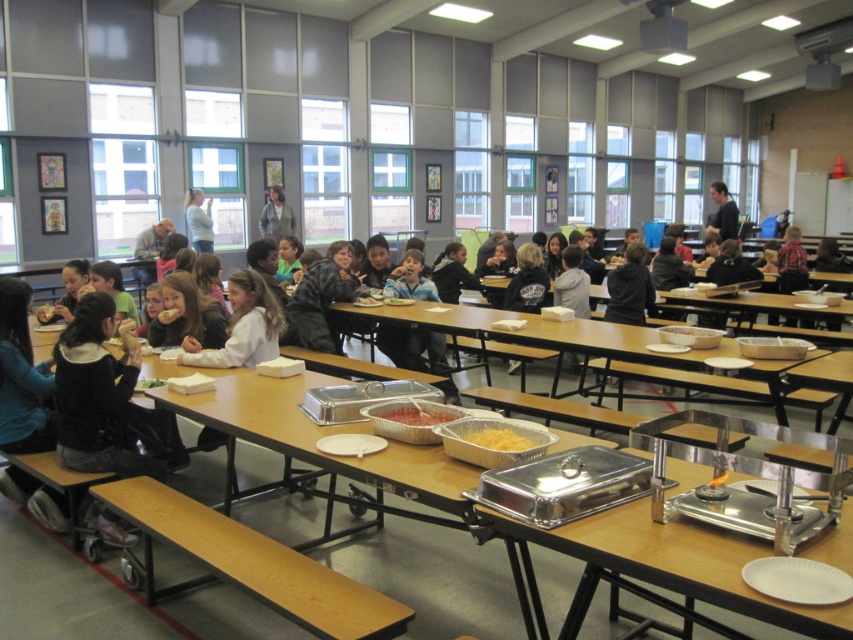
Question: Based on their relative distances, which object is farther from the silver metallic buffet at center?

Choices:
 (A) black matte jacket at upper right
 (B) silver metallic trays at center
 (C) light blue shirt at upper center

Answer: (A)

Question: Among these objects, which one is farthest from the camera?

Choices:
 (A) light blue denim jacket at upper center
 (B) shiny metallic tray at center
 (C) black matte jacket at upper right
 (D) silver metallic tray at center

Answer: (A)

Question: Which object appears farthest from the camera in this image?

Choices:
 (A) black matte jacket at upper right
 (B) yellow shredded cheese at center

Answer: (A)

Question: Can you confirm if shiny metallic tray at center is smaller than yellow shredded cheese at center?

Choices:
 (A) yes
 (B) no

Answer: (B)

Question: Is light blue denim jacket at upper center closer to the viewer compared to yellow shredded cheese at center?

Choices:
 (A) no
 (B) yes

Answer: (A)

Question: Is black matte jacket at upper right further to the viewer compared to yellow shredded cheese at center?

Choices:
 (A) yes
 (B) no

Answer: (A)